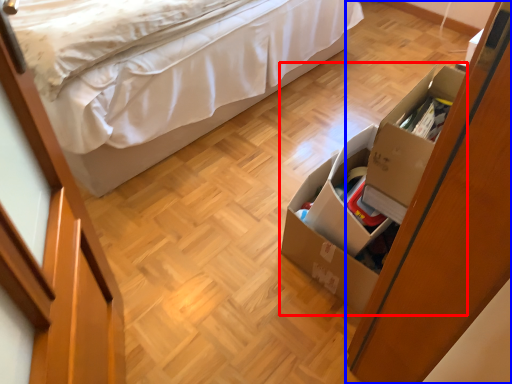
Question: Which object appears closest to the camera in this image, storage box (highlighted by a red box) or dresser (highlighted by a blue box)?

Choices:
 (A) storage box
 (B) dresser

Answer: (B)